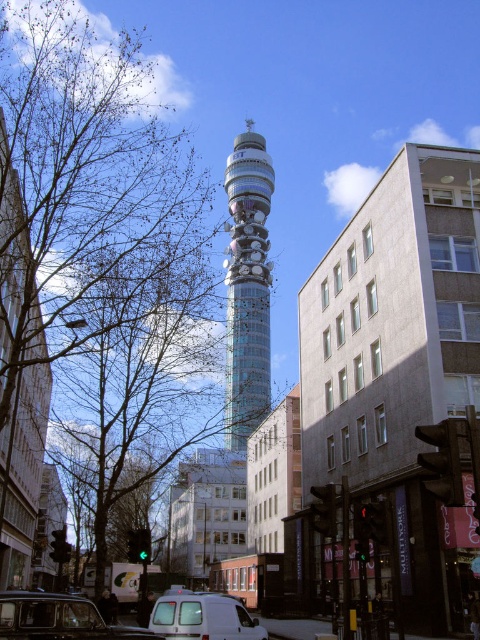
Consider the image. Can you confirm if translucent glass tower at center is bigger than black matte taxi at lower left?

Yes.

Who is more distant from viewer, (240, 321) or (50, 596)?

The point (240, 321) is behind.

Is point (238, 294) closer to camera compared to point (60, 636)?

No, (238, 294) is further to viewer.

This screenshot has width=480, height=640. I want to click on translucent glass tower at center, so click(248, 285).

Does black matte taxi at lower left appear over white matte van at lower center?

Correct, black matte taxi at lower left is located above white matte van at lower center.

Does black matte taxi at lower left appear on the right side of white matte van at lower center?

In fact, black matte taxi at lower left is to the left of white matte van at lower center.

Which is behind, point (49, 612) or point (230, 636)?

Point (230, 636)

Identify the location of black matte taxi at lower left. The image size is (480, 640). (59, 618).

Is translucent glass tower at center bigger than white matte van at lower center?

Correct, translucent glass tower at center is larger in size than white matte van at lower center.

Is translucent glass tower at center wider than white matte van at lower center?

Yes.

Who is more forward, (x=267, y=365) or (x=196, y=620)?

Point (x=196, y=620)

You are a GUI agent. You are given a task and a screenshot of the screen. Output one action in this format:
    pyautogui.click(x=<x>, y=<y>)
    Task: Click on the translucent glass tower at center
    The width and height of the screenshot is (480, 640).
    Given the screenshot: What is the action you would take?
    pyautogui.click(x=248, y=285)